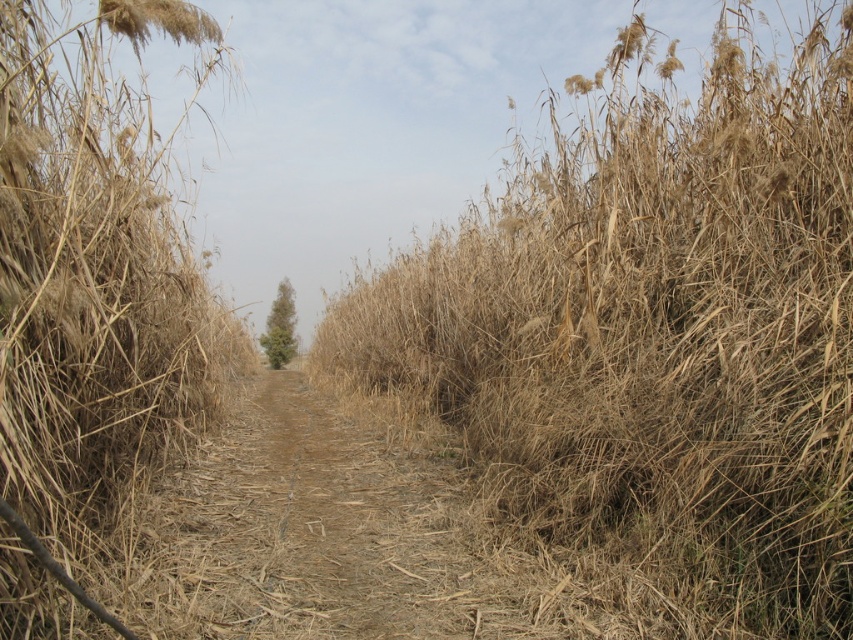
Question: Is dry straw at center further to the viewer compared to green leafy tree at center?

Choices:
 (A) no
 (B) yes

Answer: (A)

Question: In this image, where is dry grass at center located relative to dry straw at center?

Choices:
 (A) left
 (B) right

Answer: (B)

Question: Observing the image, what is the correct spatial positioning of dry grass at center in reference to green leafy tree at center?

Choices:
 (A) above
 (B) below

Answer: (A)

Question: Considering the real-world distances, which object is closest to the dry straw at center?

Choices:
 (A) dry grass at center
 (B) green leafy tree at center

Answer: (A)

Question: Which point is closer to the camera taking this photo?

Choices:
 (A) (270, 333)
 (B) (775, 145)
 (C) (18, 168)

Answer: (C)

Question: Estimate the real-world distances between objects in this image. Which object is closer to the dry grass at center?

Choices:
 (A) dry straw at center
 (B) green leafy tree at center

Answer: (A)